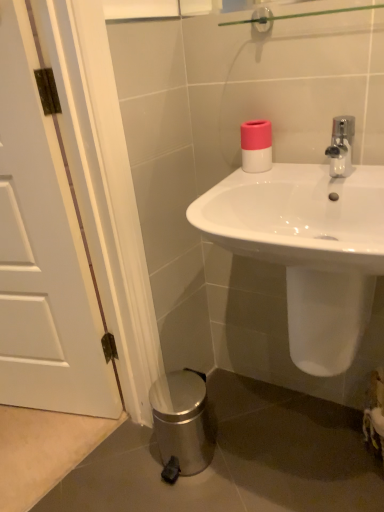
Identify the location of free space in front of pink matte toilet paper at upper right. (276, 176).